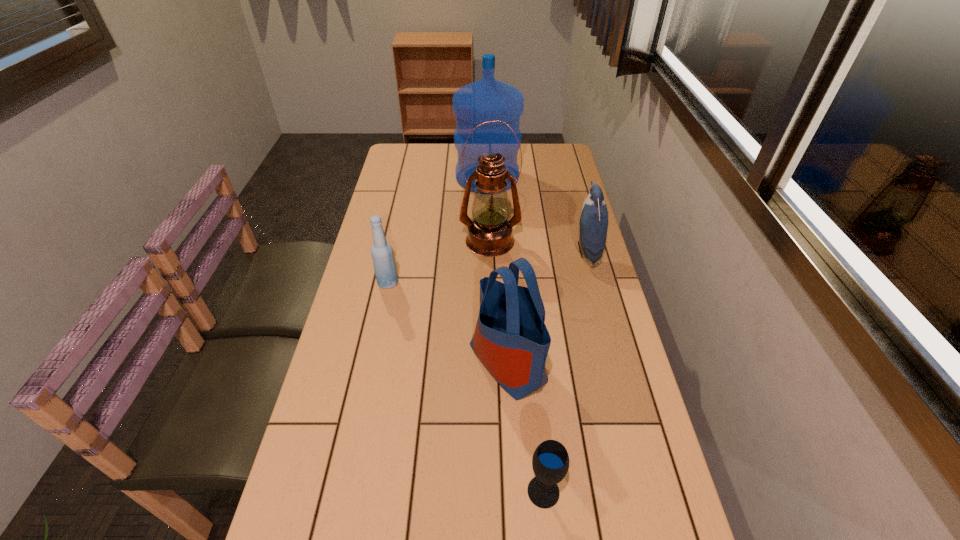
Find the location of `free space located on the left of the oil lamp`. free space located on the left of the oil lamp is located at coordinates (381, 241).

You are a GUI agent. You are given a task and a screenshot of the screen. Output one action in this format:
    pyautogui.click(x=<x>, y=<y>)
    Task: Click on the vacant space situated on the left of the second nearest object
    The image size is (960, 540).
    Given the screenshot: What is the action you would take?
    pyautogui.click(x=425, y=362)

Where is `vacant space located 0.160m on the back of the leftmost object`? This screenshot has height=540, width=960. vacant space located 0.160m on the back of the leftmost object is located at coordinates (396, 242).

Identify the location of vacant region located 0.360m at the tip of the bird's beak. (462, 251).

Find the location of a particular element. The height and width of the screenshot is (540, 960). free region located 0.380m at the tip of the bird's beak is located at coordinates (455, 251).

At what (x,y) coordinates should I click in order to perform the action: click on free space located 0.250m at the tip of the bird's beak. Please return your answer as a coordinate pair (x, y). Looking at the image, I should click on tap(496, 251).

What are the coordinates of `blank space located 0.120m on the right of the shortest object` in the screenshot? It's located at (619, 491).

Locate an element on the screen. object located at the far edge is located at coordinates [488, 99].

Locate an element on the screen. object that is at the left edge is located at coordinates (384, 264).

You are a GUI agent. You are given a task and a screenshot of the screen. Output one action in this format:
    pyautogui.click(x=<x>, y=<y>)
    Task: Click on the object that is at the right edge
    Image resolution: width=960 pixels, height=540 pixels.
    Given the screenshot: What is the action you would take?
    pyautogui.click(x=593, y=220)